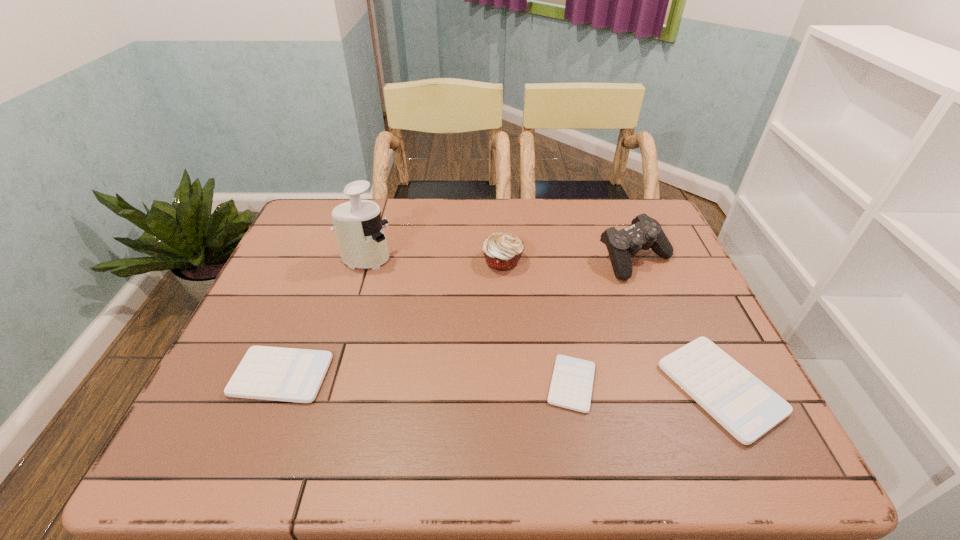
Image resolution: width=960 pixels, height=540 pixels. Find the location of `the second tallest calculator`. the second tallest calculator is located at coordinates (268, 373).

In order to click on the second shortest object in this screenshot , I will do `click(268, 373)`.

Where is `the second calculator from left to right`? the second calculator from left to right is located at coordinates (572, 381).

Identify the location of the third object from right to left. (572, 381).

In order to click on the rightmost calculator in this screenshot , I will do `click(747, 408)`.

The width and height of the screenshot is (960, 540). I want to click on control, so click(644, 233).

Find the location of a particular element. Image resolution: width=960 pixels, height=540 pixels. juicer is located at coordinates (359, 229).

Locate an element on the screen. The height and width of the screenshot is (540, 960). the fourth object from right to left is located at coordinates (502, 251).

I want to click on vacant space located 0.070m on the right of the fifth tallest object, so click(x=360, y=375).

This screenshot has width=960, height=540. What are the coordinates of `blank space located on the back of the fourth object from left to right` in the screenshot? It's located at (553, 282).